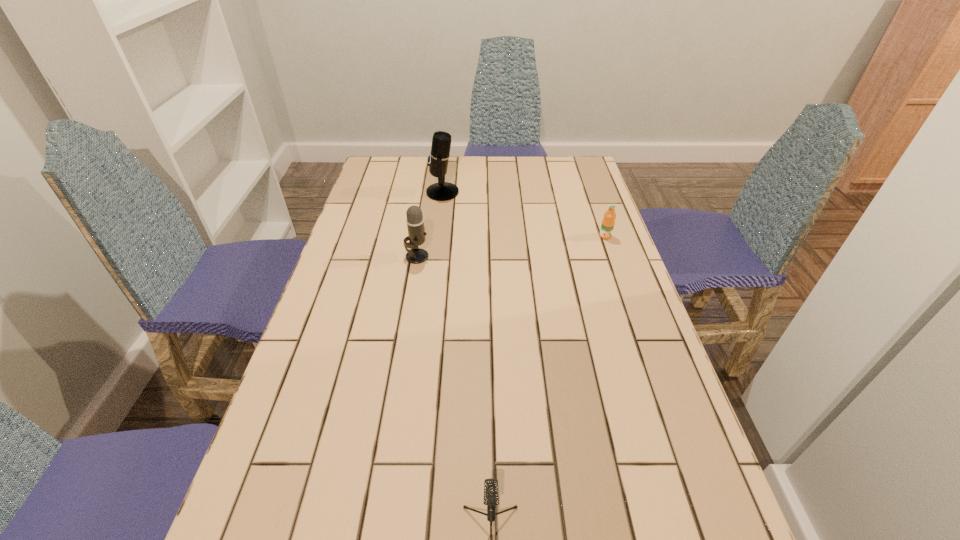
Locate an element on the screen. The image size is (960, 540). microphone that stands as the second closest to the second nearest object is located at coordinates (491, 495).